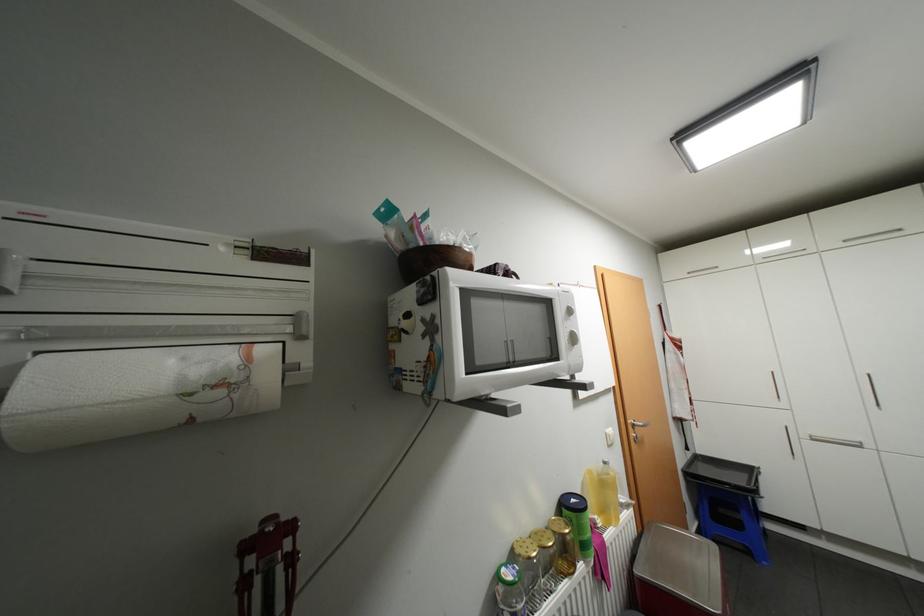
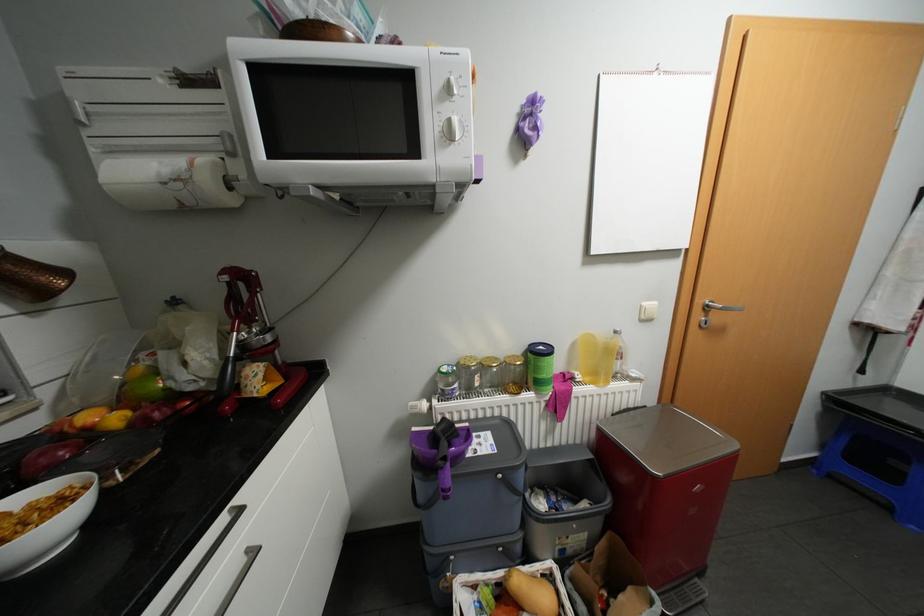
In the second image, find the point that corresponds to the point at 592,560 in the first image.

(544, 392)